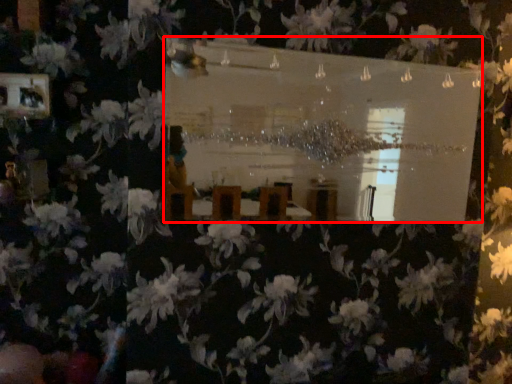
Question: Considering the relative positions of mirror (annotated by the red box) and picture frame in the image provided, where is mirror (annotated by the red box) located with respect to the staircase?

Choices:
 (A) left
 (B) right

Answer: (B)